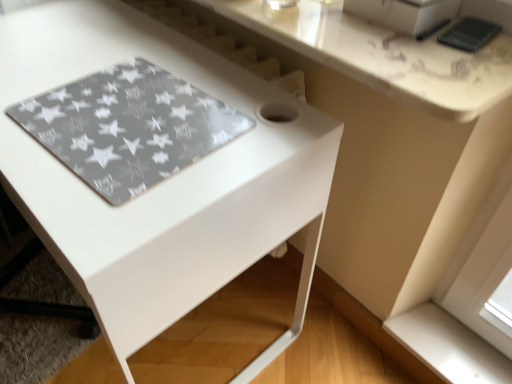
This screenshot has height=384, width=512. I want to click on vacant space that is to the left of transparent star-patterned mat at lower left, so click(x=28, y=91).